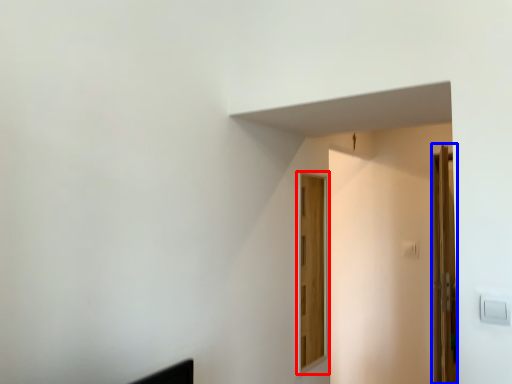
Question: Among these objects, which one is nearest to the camera, door (highlighted by a red box) or door (highlighted by a blue box)?

Choices:
 (A) door
 (B) door

Answer: (A)